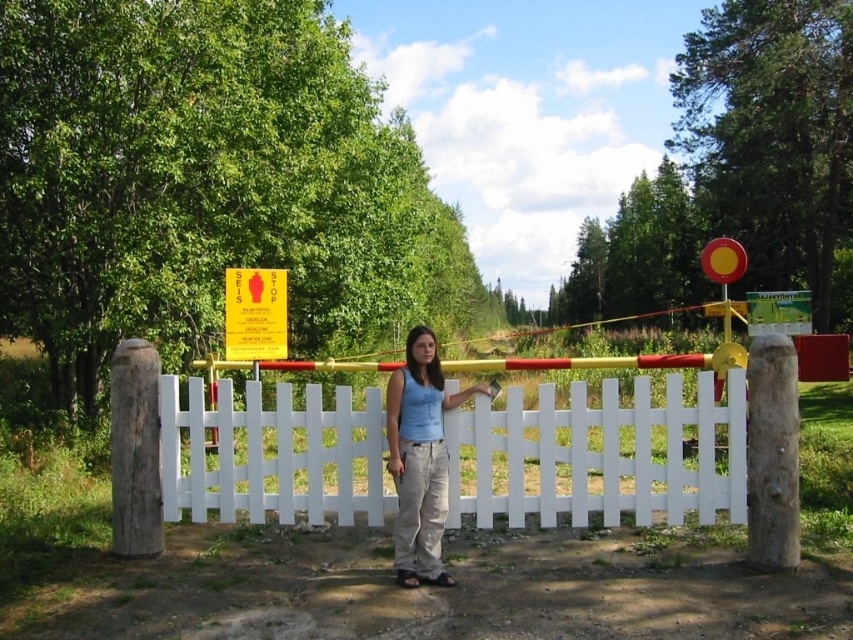
You are standing at the entrance of the rural area and see the white wooden fence at center. If you want to reach the gate behind the fence, which direction should you move relative to the fence?

The white wooden fence at center is located at point (598, 456), so you should move towards the direction of the gate behind the fence, which is behind the white wooden fence at center.

You are a delivery person trying to see if you can spot the light blue cotton shirt at center from behind the white wooden fence at center. Can you see it?

The white wooden fence at center is below the light blue cotton shirt at center, so yes, the light blue cotton shirt at center is visible above the white wooden fence at center.